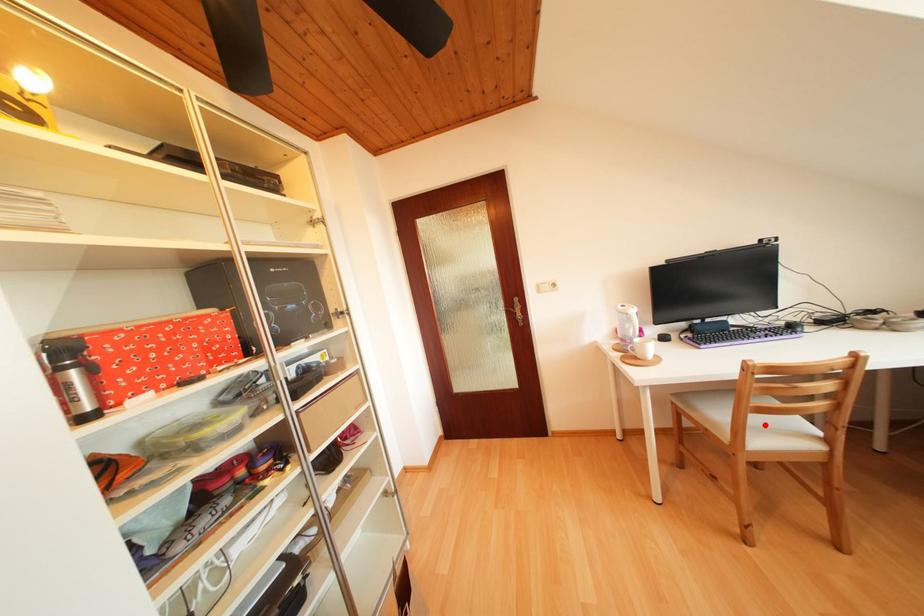
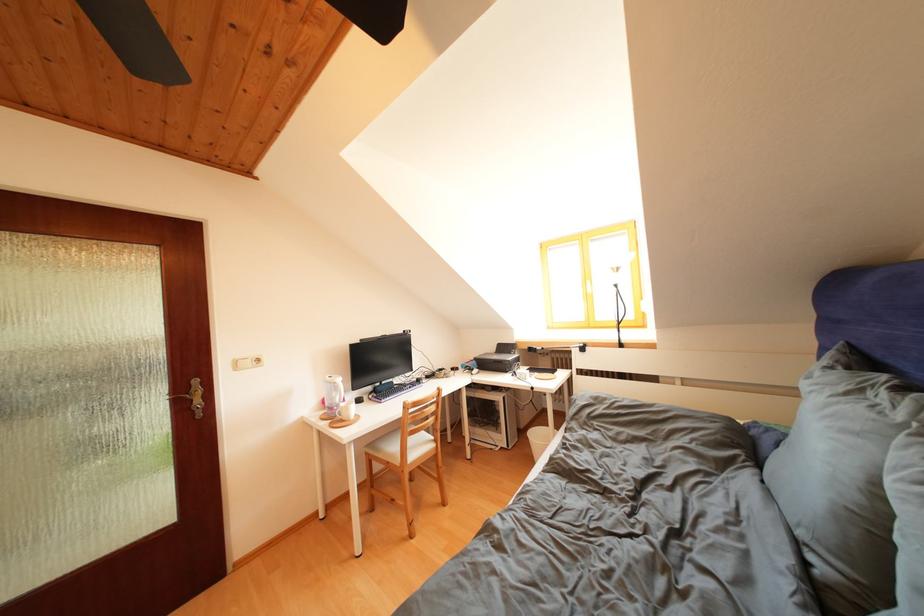
Question: A red point is marked in image1. In image2, is the corresponding 3D point closer to the camera or farther? Reply with the corresponding letter.

Choices:
 (A) The corresponding 3D point is closer.
 (B) The corresponding 3D point is farther.

Answer: (B)